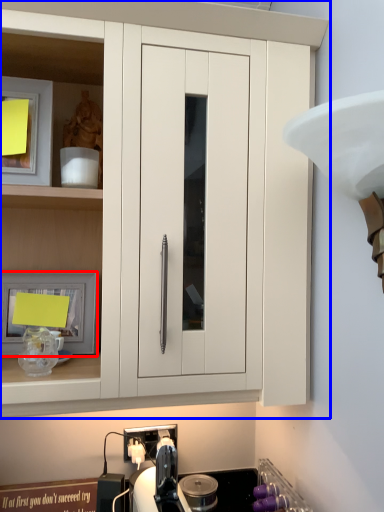
Question: Which object is closer to the camera taking this photo, picture frame (highlighted by a red box) or cabinetry (highlighted by a blue box)?

Choices:
 (A) picture frame
 (B) cabinetry

Answer: (B)